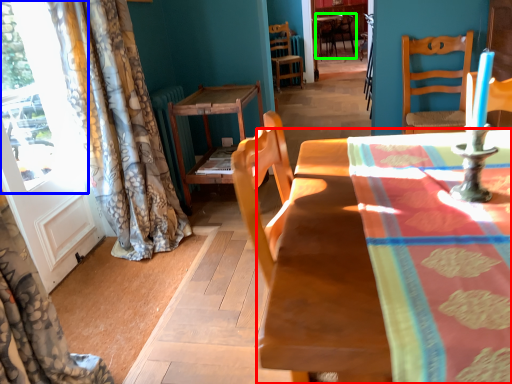
Question: Which object is the farthest from table (highlighted by a red box)? Choose among these: window (highlighted by a blue box) or chair (highlighted by a green box).

Choices:
 (A) window
 (B) chair

Answer: (B)